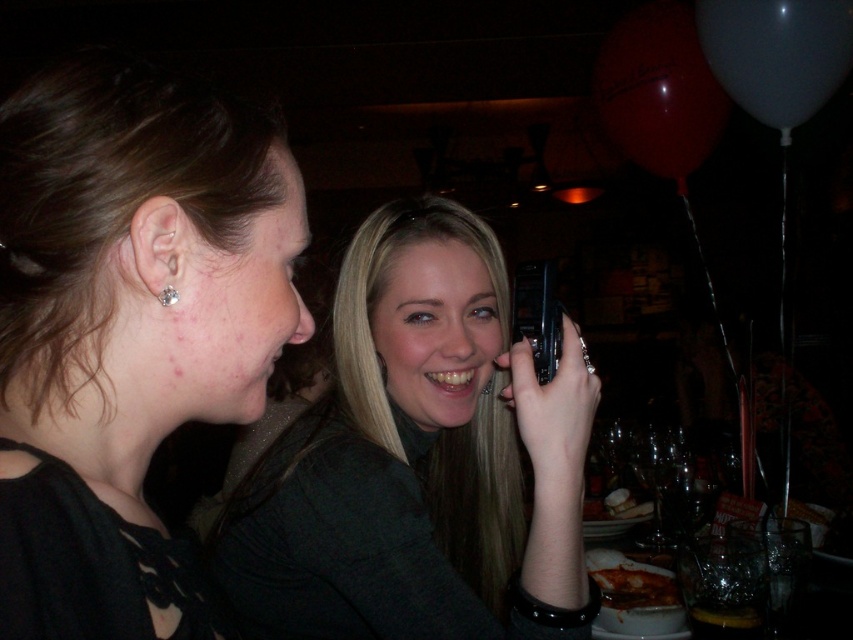
Consider the image. Is matte silver earring at left above smooth gray shirt at center?

Correct, matte silver earring at left is located above smooth gray shirt at center.

Which is behind, point (38, 257) or point (495, 540)?

The point (495, 540) is behind.

Find the location of a particular element. This screenshot has height=640, width=853. matte silver earring at left is located at coordinates (126, 330).

What do you see at coordinates (126, 330) in the screenshot?
I see `matte silver earring at left` at bounding box center [126, 330].

Who is more distant from viewer, (13, 524) or (160, 298)?

Positioned behind is point (160, 298).

Which is in front, point (175, 211) or point (167, 300)?

Point (175, 211) is in front.

Identify the location of matte silver earring at left. (126, 330).

Is black plastic phone at center further to the viewer compared to silver metallic earring at ear?

Yes, black plastic phone at center is further from the viewer.

Does point (518, 269) lie in front of point (166, 296)?

No.

Is point (546, 308) more distant than point (167, 284)?

Yes.

You are a GUI agent. You are given a task and a screenshot of the screen. Output one action in this format:
    pyautogui.click(x=<x>, y=<y>)
    Task: Click on the black plastic phone at center
    The height and width of the screenshot is (640, 853).
    Given the screenshot: What is the action you would take?
    pyautogui.click(x=537, y=316)